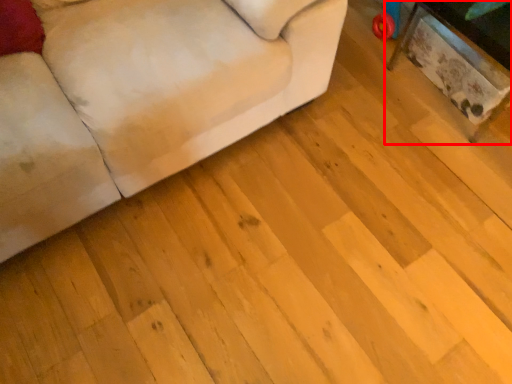
Question: Considering the relative positions of table (annotated by the red box) and studio couch in the image provided, where is table (annotated by the red box) located with respect to the staircase?

Choices:
 (A) left
 (B) right

Answer: (B)